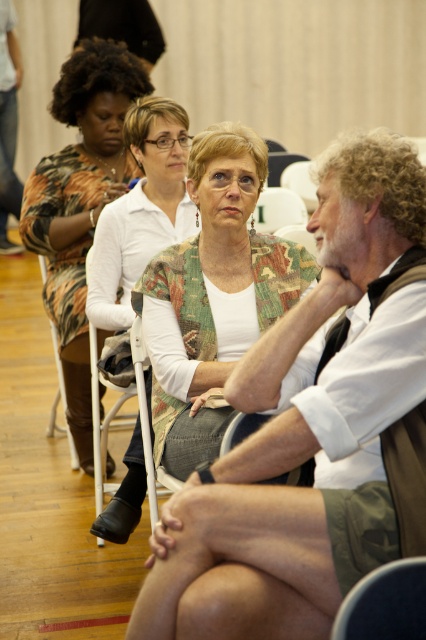
Is white shirt at center smaller than printed fabric dress at center?

Yes, white shirt at center is smaller than printed fabric dress at center.

Can you confirm if white shirt at center is bigger than printed fabric dress at center?

No.

Identify the location of white shirt at center. The width and height of the screenshot is (426, 640). pyautogui.click(x=305, y=428).

Locate an element on the screen. white shirt at center is located at coordinates (305, 428).

Is camouflage-patterned jacket at center below printed fabric dress at center?

Yes, camouflage-patterned jacket at center is below printed fabric dress at center.

Who is more distant from viewer, (103, 538) or (51, 182)?

The point (51, 182) is behind.

Which is in front, point (258, 284) or point (126, 74)?

Positioned in front is point (258, 284).

Identify the location of camouflage-patterned jacket at center. This screenshot has height=640, width=426. (213, 292).

Is printed fabric dress at center to the left of white textured shirt at center from the viewer's perspective?

Correct, you'll find printed fabric dress at center to the left of white textured shirt at center.

Between printed fabric dress at center and white textured shirt at center, which one appears on the right side from the viewer's perspective?

From the viewer's perspective, white textured shirt at center appears more on the right side.

Locate an element on the screen. printed fabric dress at center is located at coordinates (80, 202).